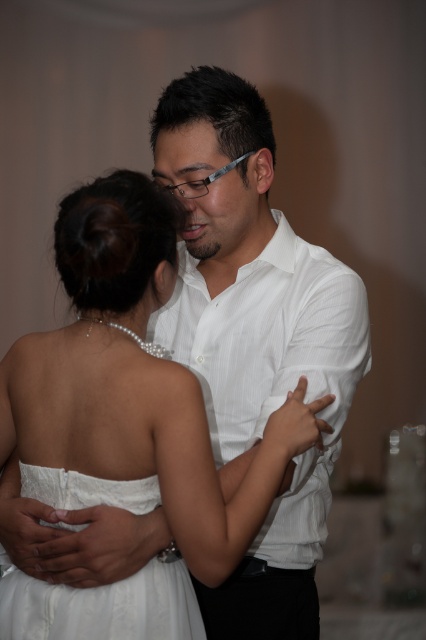
Question: In this image, where is white smooth shirt at center located relative to white lace dress at center?

Choices:
 (A) below
 (B) above

Answer: (B)

Question: Which point appears farthest from the camera in this image?

Choices:
 (A) (161, 564)
 (B) (258, 240)

Answer: (B)

Question: Which point is farther to the camera?

Choices:
 (A) white satin dress at center
 (B) white smooth shirt at center

Answer: (B)

Question: Which object is positioned closest to the white satin dress at center?

Choices:
 (A) white lace dress at center
 (B) white smooth shirt at center

Answer: (A)

Question: Observing the image, what is the correct spatial positioning of white smooth shirt at center in reference to white lace dress at center?

Choices:
 (A) above
 (B) below

Answer: (A)

Question: Does white smooth shirt at center appear on the right side of white lace dress at center?

Choices:
 (A) no
 (B) yes

Answer: (B)